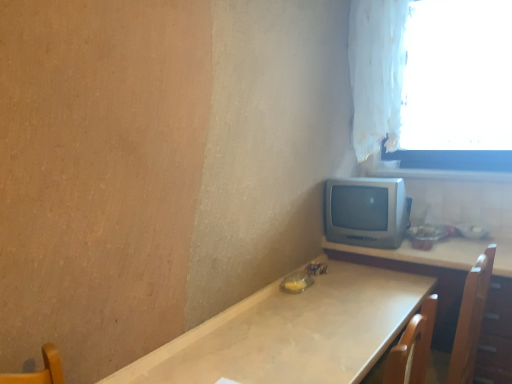
Question: Is matte wooden table at right, which is the 2th table from left to right, taller or shorter than white fabric curtain at upper right?

Choices:
 (A) tall
 (B) short

Answer: (B)

Question: From the image's perspective, relative to white fabric curtain at upper right, is matte wooden table at right, which is the 1th table from right to left, above or below?

Choices:
 (A) above
 (B) below

Answer: (B)

Question: Which object is positioned closest to the white sheer curtain at upper right?

Choices:
 (A) white fabric curtain at upper right
 (B) matte wooden table at right, which is the 1th table from right to left
 (C) matte white table at center, which appears as the second table when viewed from the right
 (D) silver metallic tv at center-right

Answer: (A)

Question: Which object is the farthest from the matte wooden table at right, which is the 1th table from right to left?

Choices:
 (A) white fabric curtain at upper right
 (B) silver metallic tv at center-right
 (C) white sheer curtain at upper right
 (D) matte white table at center, which appears as the second table when viewed from the right

Answer: (C)